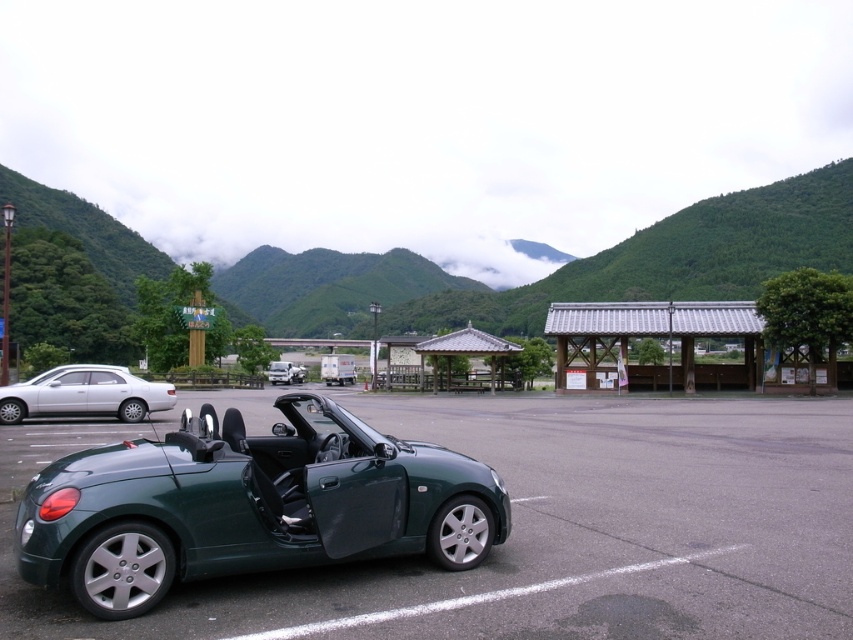
Question: Which of the following is the closest to the observer?

Choices:
 (A) (51, 371)
 (B) (230, 458)
 (C) (300, 371)

Answer: (B)

Question: Which point is farther from the camera taking this photo?

Choices:
 (A) (270, 381)
 (B) (93, 394)

Answer: (A)

Question: Does green matte sports car at center appear on the left side of matte silver sedan at left?

Choices:
 (A) no
 (B) yes

Answer: (A)

Question: Can you confirm if green matte sports car at center is thinner than metallic silver truck at center?

Choices:
 (A) no
 (B) yes

Answer: (A)

Question: Is matte silver sedan at left behind metallic silver truck at center?

Choices:
 (A) no
 (B) yes

Answer: (A)

Question: Which is nearer to the matte silver sedan at left?

Choices:
 (A) metallic silver truck at center
 (B) green matte sports car at center

Answer: (B)